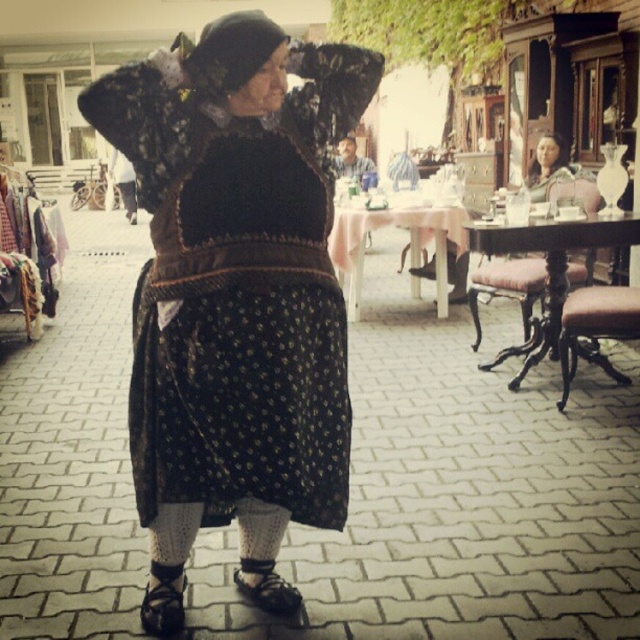
Question: Is black textured dress at center above brown leather stool at lower right?

Choices:
 (A) no
 (B) yes

Answer: (B)

Question: Is black textured dress at center closer to the viewer compared to brown leather stool at lower right?

Choices:
 (A) no
 (B) yes

Answer: (B)

Question: Which of the following is the closest to the observer?

Choices:
 (A) brown leather stool at lower right
 (B) black textured dress at center

Answer: (B)

Question: Can you confirm if black textured dress at center is smaller than brown leather stool at lower right?

Choices:
 (A) yes
 (B) no

Answer: (B)

Question: Which point is closer to the camera?

Choices:
 (A) (561, 356)
 (B) (198, 449)

Answer: (B)